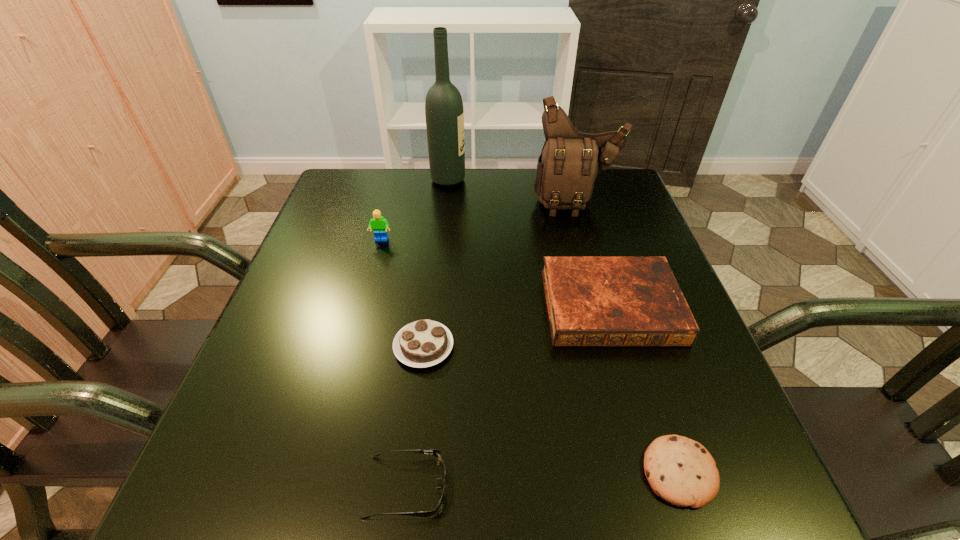
Where is `wine bottle`? Image resolution: width=960 pixels, height=540 pixels. wine bottle is located at coordinates (444, 113).

Locate an element on the screen. This screenshot has height=540, width=960. the sixth shortest object is located at coordinates (570, 161).

Find the location of a particular element. This screenshot has width=960, height=540. the fifth shortest object is located at coordinates (379, 225).

Locate an element on the screen. Lego is located at coordinates (379, 225).

Locate an element on the screen. This screenshot has width=960, height=540. Bible is located at coordinates point(592,301).

In order to click on chocolate cake in this screenshot , I will do `click(423, 343)`.

Find the location of `cookie`. cookie is located at coordinates (x=681, y=471).

Find the location of a particular element. This screenshot has width=960, height=540. sunglasses is located at coordinates (437, 453).

Identify the location of free space located 0.060m on the labeled side of the tallest object. This screenshot has height=540, width=960. (487, 180).

Where is `vacant position located 0.050m on the front-facing side of the second tallest object`? The image size is (960, 540). vacant position located 0.050m on the front-facing side of the second tallest object is located at coordinates (584, 230).